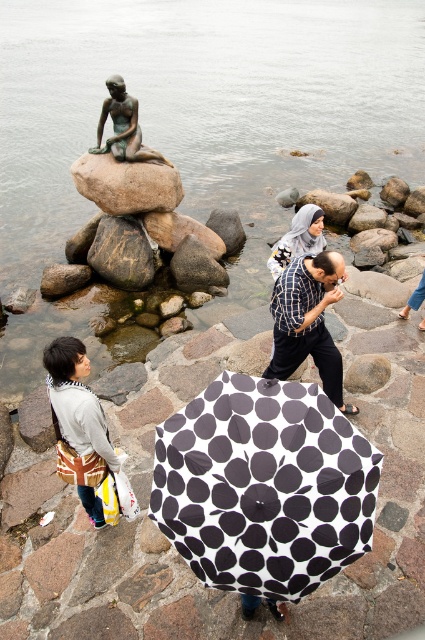
In the scene shown: You are standing at the center of the stone pathway near the water and want to place your gray fabric bag at lower left exactly at coordinate point 0.664, 0.186. Can you confirm if this coordinate is within the visible pathway area?

The gray fabric bag at lower left is already positioned at coordinate point (79, 424), which is within the visible pathway area.

You are an artist planning to sketch this scene. You want to ensure the black dotted fabric umbrella at center and the bronze statue at upper left are proportionally accurate. Which object should you draw first to maintain scale, and why?

You should draw the bronze statue at upper left first because it is wider than the black dotted fabric umbrella at center, so establishing its size will help you accurately scale the thinner umbrella accordingly.